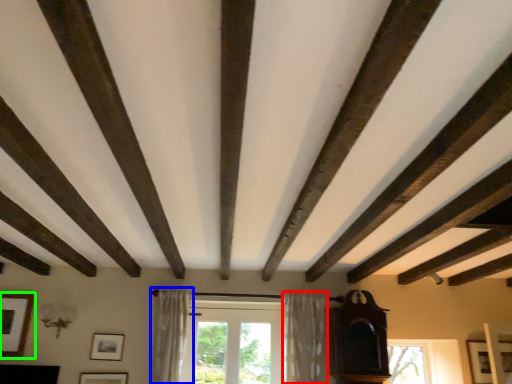
Question: Estimate the real-world distances between objects in this image. Which object is closer to curtain (highlighted by a red box), curtain (highlighted by a blue box) or picture frame (highlighted by a green box)?

Choices:
 (A) curtain
 (B) picture frame

Answer: (A)